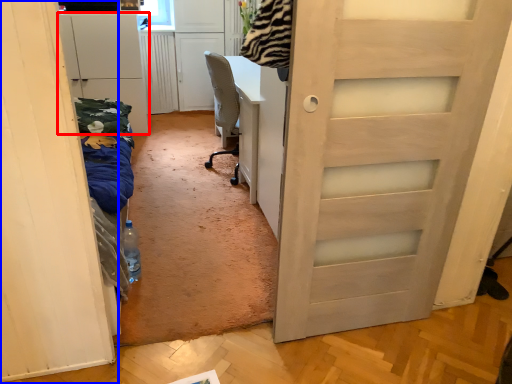
Question: Which point is closer to the camera, cabinetry (highlighted by a red box) or door (highlighted by a blue box)?

Choices:
 (A) cabinetry
 (B) door

Answer: (B)